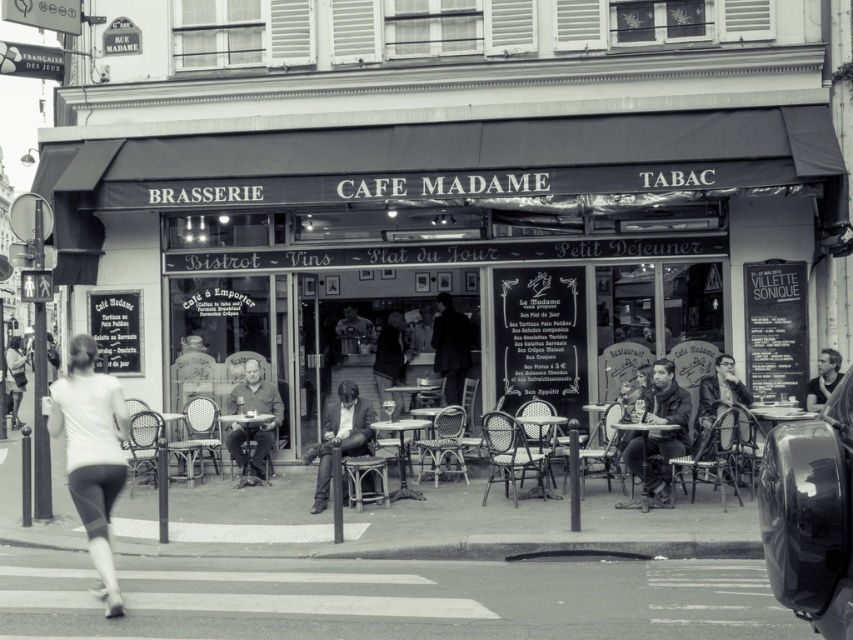
Based on the photo, you are standing at the point with coordinates point (824, 401) and want to walk to the point with coordinates point (392, 348). According to the scene, which direction should you move to reach your destination?

To reach point (392, 348) from point (824, 401), you should move towards the lower left direction since point (392, 348) is behind point (824, 401) in the scene.

In the scene of the lively street in front of the black and white photo of the cafe named Cafe Madame, there is a point marked at coordinates (91, 452). What object is located at that point?

The point at coordinates (91, 452) indicates white fabric pants at lower left.

You are standing in the street in front of the black and white photo of the Cafe Madame. There are two points marked on the photo. The first point is at coordinate (103, 502) and the second is at (271, 419). Based on the scene, which point is closer to you?

Point (103, 502) is closer to the viewer than point (271, 419).